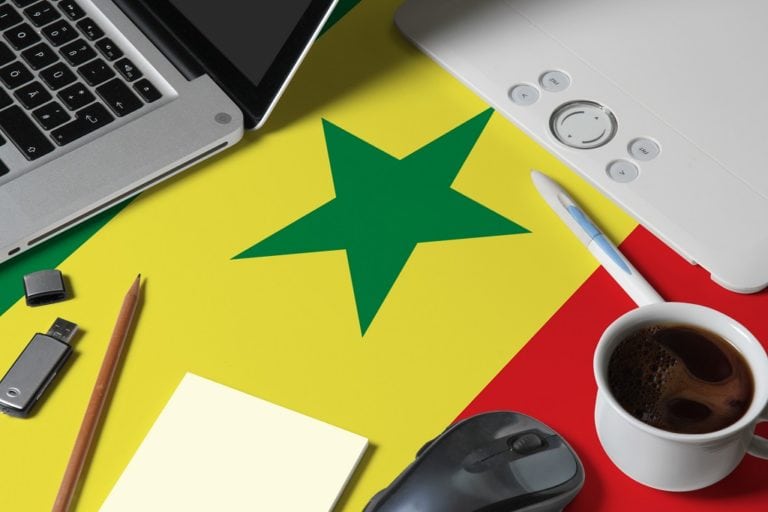
At what (x,y) coordinates should I click in order to perform the action: click on laptop screen. Please return your answer as a coordinate pair (x, y). Image resolution: width=768 pixels, height=512 pixels. Looking at the image, I should click on (237, 28).